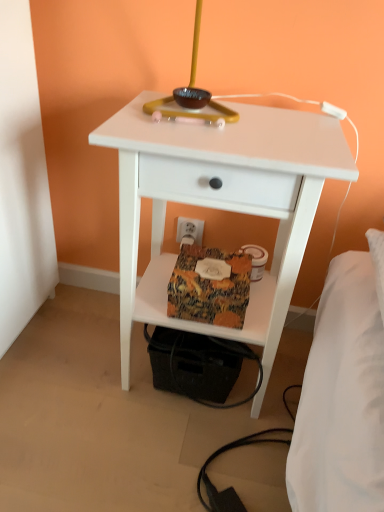
Question: Is white matte nightstand at center inside matte yellow table lamp at upper center?

Choices:
 (A) no
 (B) yes

Answer: (A)

Question: Is matte yellow table lamp at upper center at the right side of white matte nightstand at center?

Choices:
 (A) no
 (B) yes

Answer: (A)

Question: From the image's perspective, does matte yellow table lamp at upper center appear higher than white matte nightstand at center?

Choices:
 (A) no
 (B) yes

Answer: (B)

Question: From a real-world perspective, is matte yellow table lamp at upper center located beneath white matte nightstand at center?

Choices:
 (A) yes
 (B) no

Answer: (B)

Question: Can you confirm if matte yellow table lamp at upper center is bigger than white matte nightstand at center?

Choices:
 (A) no
 (B) yes

Answer: (A)

Question: Considering the positions of point (193, 33) and point (241, 292), is point (193, 33) closer or farther from the camera than point (241, 292)?

Choices:
 (A) farther
 (B) closer

Answer: (A)

Question: In terms of height, does matte yellow table lamp at upper center look taller or shorter compared to textured fabric package at lower center?

Choices:
 (A) tall
 (B) short

Answer: (A)

Question: Looking at the image, does matte yellow table lamp at upper center seem bigger or smaller compared to textured fabric package at lower center?

Choices:
 (A) small
 (B) big

Answer: (B)

Question: From a real-world perspective, is matte yellow table lamp at upper center physically located above or below textured fabric package at lower center?

Choices:
 (A) above
 (B) below

Answer: (A)

Question: Relative to white matte nightstand at center, is white plastic electric outlet at lower center in front or behind?

Choices:
 (A) behind
 (B) front

Answer: (A)

Question: In the image, is white plastic electric outlet at lower center on the left side or the right side of white matte nightstand at center?

Choices:
 (A) left
 (B) right

Answer: (A)

Question: Is white plastic electric outlet at lower center inside the boundaries of white matte nightstand at center, or outside?

Choices:
 (A) inside
 (B) outside

Answer: (B)

Question: From the image's perspective, is white plastic electric outlet at lower center above or below white matte nightstand at center?

Choices:
 (A) below
 (B) above

Answer: (B)

Question: Is white plastic electric outlet at lower center bigger or smaller than matte yellow table lamp at upper center?

Choices:
 (A) big
 (B) small

Answer: (B)

Question: From the image's perspective, is white plastic electric outlet at lower center positioned above or below matte yellow table lamp at upper center?

Choices:
 (A) above
 (B) below

Answer: (B)